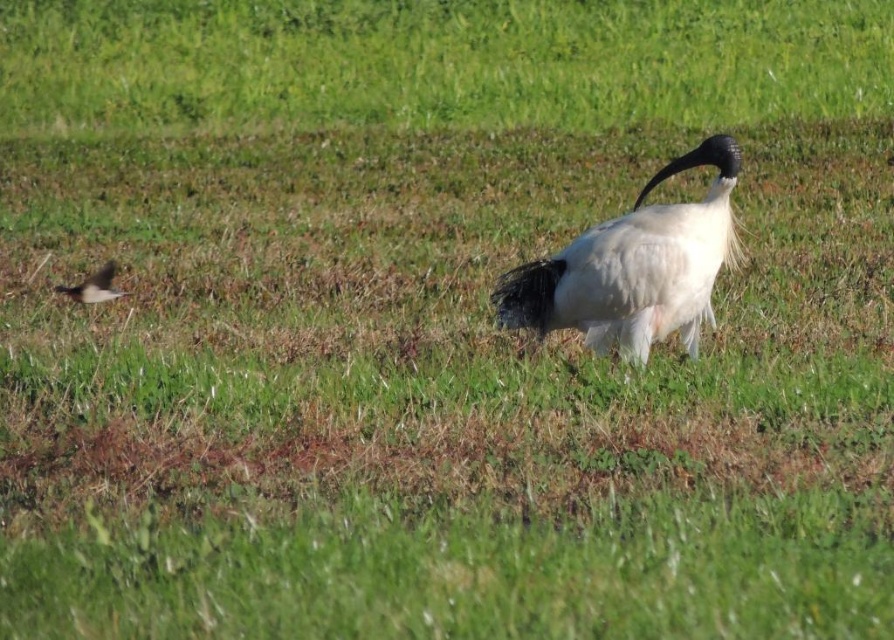
How distant is white glossy bird at center from brown feathered bird at left?

white glossy bird at center is 13.02 feet away from brown feathered bird at left.

Between white glossy bird at center and brown feathered bird at left, which one has more height?

With more height is white glossy bird at center.

Where is `white glossy bird at center`? This screenshot has width=894, height=640. white glossy bird at center is located at coordinates (634, 268).

Locate an element on the screen. Image resolution: width=894 pixels, height=640 pixels. white glossy bird at center is located at coordinates (634, 268).